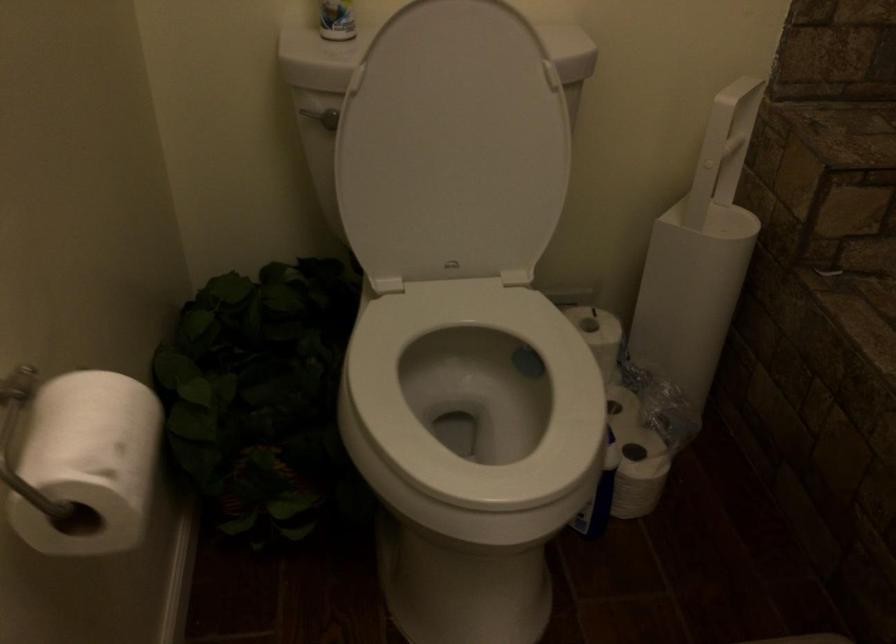
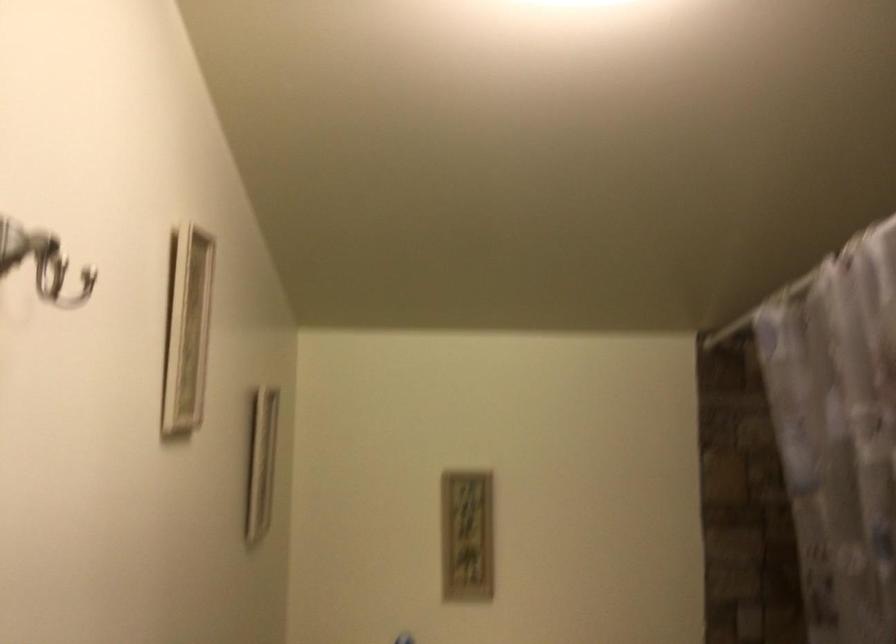
Question: Based on the continuous images, in which direction is the camera rotating? Reply with the corresponding letter.

Choices:
 (A) Left
 (B) Right
 (C) Up
 (D) Down

Answer: (C)